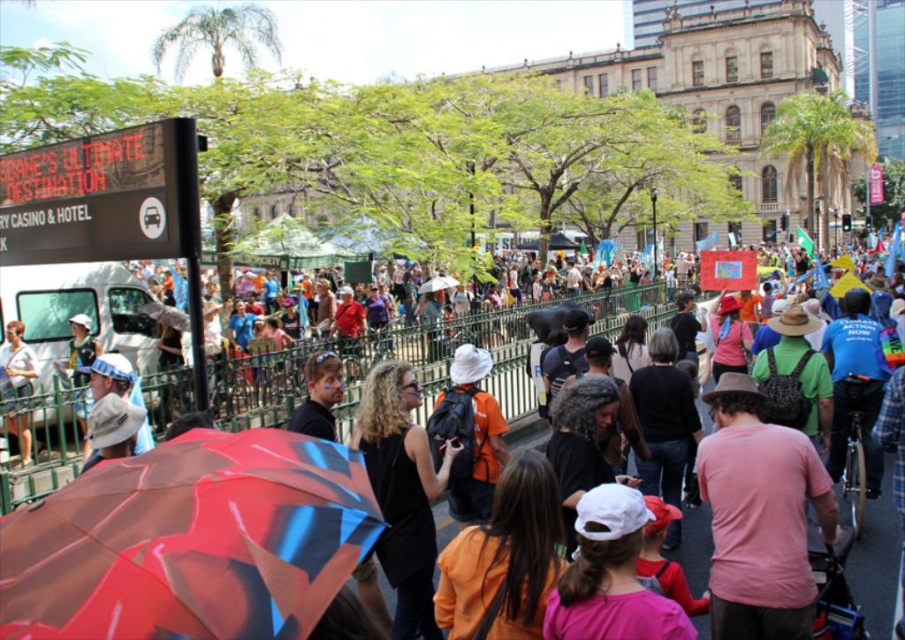
Does shiny plastic umbrella at center have a greater width compared to matte black tank top at lower left?

Yes.

Is shiny plastic umbrella at center shorter than matte black tank top at lower left?

Yes, shiny plastic umbrella at center is shorter than matte black tank top at lower left.

Between point (199, 452) and point (14, 346), which one is positioned in front?

Point (199, 452) is in front.

The width and height of the screenshot is (905, 640). Identify the location of shiny plastic umbrella at center. (189, 541).

Is orange matte shirt at center further to the viewer compared to matte black tank top at lower left?

No, it is not.

Does orange matte shirt at center have a greater height compared to matte black tank top at lower left?

Correct, orange matte shirt at center is much taller as matte black tank top at lower left.

Between point (489, 394) and point (24, 435), which one is positioned in front?

Positioned in front is point (24, 435).

Locate an element on the screen. orange matte shirt at center is located at coordinates (474, 436).

Does shiny plastic umbrella at center lie behind orange matte shirt at center?

No, shiny plastic umbrella at center is in front of orange matte shirt at center.

Is point (253, 515) positioned in front of point (486, 401)?

Yes, point (253, 515) is in front of point (486, 401).

The height and width of the screenshot is (640, 905). I want to click on shiny plastic umbrella at center, so click(x=189, y=541).